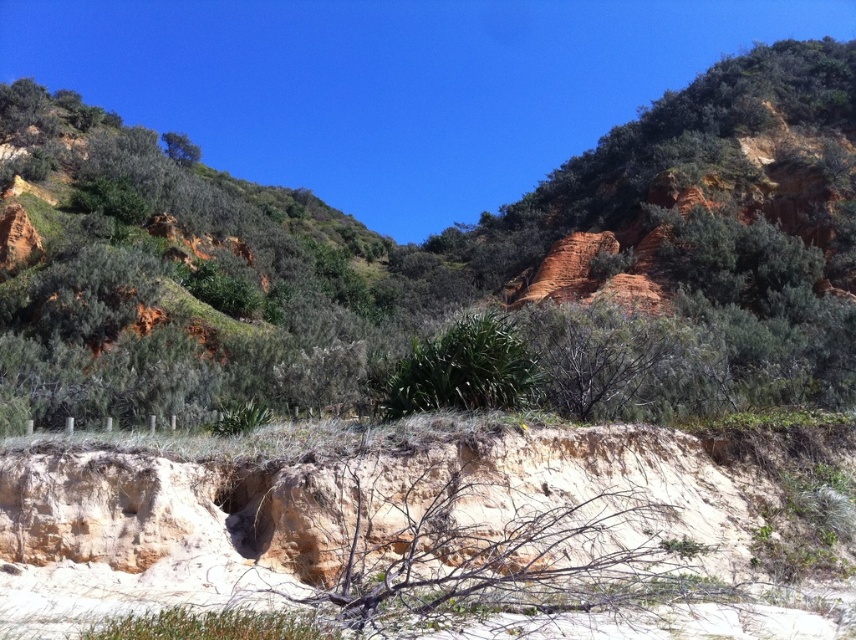
Question: Which of the following is the closest to the observer?

Choices:
 (A) green leafy tree at upper left
 (B) rustic clay hill at center

Answer: (B)

Question: In this image, where is rustic clay hill at center located relative to green leafy tree at upper left?

Choices:
 (A) above
 (B) below

Answer: (B)

Question: Is rustic clay hill at center smaller than green leafy tree at upper left?

Choices:
 (A) yes
 (B) no

Answer: (B)

Question: Is rustic clay hill at center in front of green leafy tree at upper left?

Choices:
 (A) yes
 (B) no

Answer: (A)